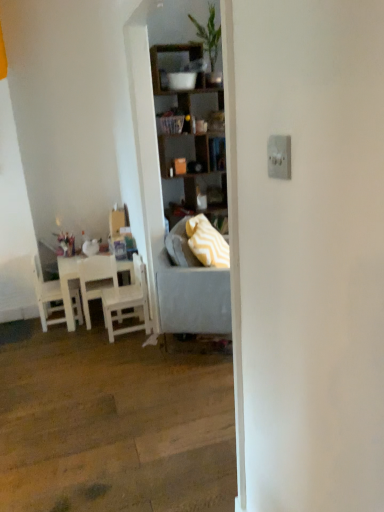
Question: From a real-world perspective, is wooden shelves at center below gray fabric studio couch at center?

Choices:
 (A) yes
 (B) no

Answer: (B)

Question: Is wooden shelves at center looking in the opposite direction of gray fabric studio couch at center?

Choices:
 (A) yes
 (B) no

Answer: (B)

Question: From the image's perspective, is wooden shelves at center located above gray fabric studio couch at center?

Choices:
 (A) no
 (B) yes

Answer: (B)

Question: Does wooden shelves at center appear on the left side of gray fabric studio couch at center?

Choices:
 (A) yes
 (B) no

Answer: (A)

Question: Does wooden shelves at center have a lesser height compared to gray fabric studio couch at center?

Choices:
 (A) yes
 (B) no

Answer: (B)

Question: From a real-world perspective, is wooden shelves at center positioned over gray fabric studio couch at center based on gravity?

Choices:
 (A) yes
 (B) no

Answer: (A)

Question: Does white wood chair at left, positioned as the third chair in right-to-left order, have a greater width compared to yellow zigzag fabric pillow at center?

Choices:
 (A) yes
 (B) no

Answer: (A)

Question: Is the position of white wood chair at left, positioned as the third chair in right-to-left order, less distant than that of yellow zigzag fabric pillow at center?

Choices:
 (A) yes
 (B) no

Answer: (B)

Question: Is the position of white wood chair at left, acting as the first chair starting from the left, more distant than that of yellow zigzag fabric pillow at center?

Choices:
 (A) no
 (B) yes

Answer: (B)

Question: Can we say white wood chair at left, acting as the first chair starting from the left, lies outside yellow zigzag fabric pillow at center?

Choices:
 (A) no
 (B) yes

Answer: (B)

Question: From the image's perspective, is white wood chair at left, positioned as the third chair in right-to-left order, located above yellow zigzag fabric pillow at center?

Choices:
 (A) yes
 (B) no

Answer: (B)

Question: Would you say yellow zigzag fabric pillow at center is part of white wood chair at left, acting as the first chair starting from the left,'s contents?

Choices:
 (A) yes
 (B) no

Answer: (B)

Question: Is white wood chair at left, the first chair when ordered from right to left, looking in the opposite direction of white matte chair at left, which ranks as the 2th chair in left-to-right order?

Choices:
 (A) no
 (B) yes

Answer: (A)